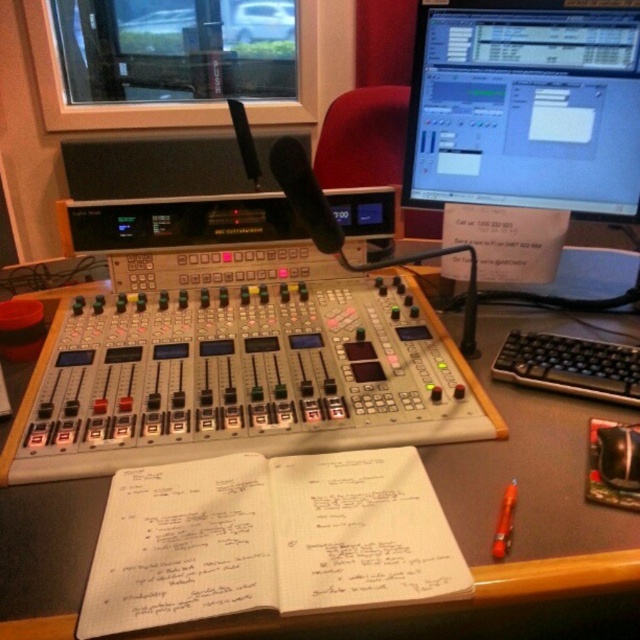
You are standing in front of the audio mixing console and need to place a 12 inch wide laptop on the black plastic table at center. Can the laptop fit on the table?

The black plastic table at center is 21.97 inches from viewer, but the width of the table is not provided. Therefore, it is impossible to determine if the 12 inch wide laptop can fit on the table.